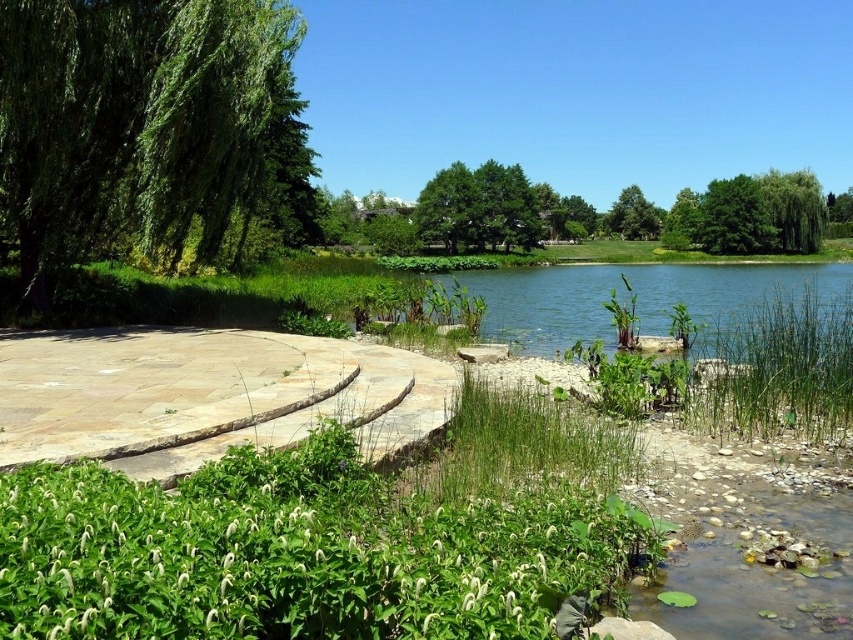
Question: Does natural stone path at center appear under green leafy tree at center?

Choices:
 (A) yes
 (B) no

Answer: (A)

Question: Among these objects, which one is nearest to the camera?

Choices:
 (A) clear blue water at center
 (B) green leafy tree at upper center

Answer: (A)

Question: Which object appears closest to the camera in this image?

Choices:
 (A) green leafy tree at upper center
 (B) natural stone path at center
 (C) green leafy tree at left
 (D) clear blue water at center

Answer: (B)

Question: Is clear blue water at center closer to the viewer compared to green leafy tree at upper center?

Choices:
 (A) yes
 (B) no

Answer: (A)

Question: Is green leafy tree at center positioned in front of green leafy tree at upper center?

Choices:
 (A) yes
 (B) no

Answer: (A)

Question: Which of the following is the farthest from the observer?

Choices:
 (A) clear blue water at center
 (B) green leafy tree at left
 (C) green leafy tree at center

Answer: (C)